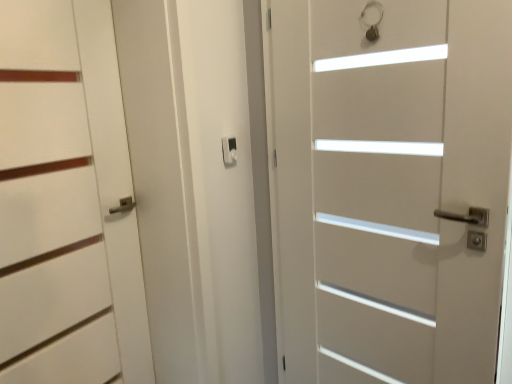
Locate an element on the screen. This screenshot has height=384, width=512. white matte door at center, which is counted as the 2th door, starting from the left is located at coordinates (388, 186).

At what (x,y) coordinates should I click in order to perform the action: click on white matte door at left, which ranks as the 1th door in left-to-right order. Please return your answer as a coordinate pair (x, y). The height and width of the screenshot is (384, 512). Looking at the image, I should click on (66, 202).

How different are the orientations of white matte door at left, positioned as the second door in right-to-left order, and white matte door at center, the first door in the right-to-left sequence, in degrees?

The angle between the facing direction of white matte door at left, positioned as the second door in right-to-left order, and the facing direction of white matte door at center, the first door in the right-to-left sequence, is 113 degrees.

Is white matte door at left, positioned as the second door in right-to-left order, not close to white matte door at center, the first door in the right-to-left sequence?

They are positioned close to each other.

The width and height of the screenshot is (512, 384). Find the location of `door in front of the white matte door at left, which ranks as the 1th door in left-to-right order`. door in front of the white matte door at left, which ranks as the 1th door in left-to-right order is located at coordinates (388, 186).

Considering the positions of objects white matte door at left, which ranks as the 1th door in left-to-right order, and white matte door at center, the first door in the right-to-left sequence, in the image provided, who is behind, white matte door at left, which ranks as the 1th door in left-to-right order, or white matte door at center, the first door in the right-to-left sequence,?

A: Positioned behind is white matte door at left, which ranks as the 1th door in left-to-right order.

Is white matte door at left, positioned as the second door in right-to-left order, next to matte black latch at center?

No, white matte door at left, positioned as the second door in right-to-left order, is not beside matte black latch at center.

From the image's perspective, is white matte door at left, positioned as the second door in right-to-left order, below matte black latch at center?

Correct, white matte door at left, positioned as the second door in right-to-left order, appears lower than matte black latch at center in the image.

Considering the relative positions of white matte door at left, which ranks as the 1th door in left-to-right order, and matte black latch at center in the image provided, is white matte door at left, which ranks as the 1th door in left-to-right order, to the left of matte black latch at center from the viewer's perspective?

Correct, you'll find white matte door at left, which ranks as the 1th door in left-to-right order, to the left of matte black latch at center.

Is white matte door at left, positioned as the second door in right-to-left order, oriented away from matte black latch at center?

No, matte black latch at center is not at the back of white matte door at left, positioned as the second door in right-to-left order.

Which of these two, white matte door at center, the first door in the right-to-left sequence, or matte black latch at center, is smaller?

Smaller between the two is matte black latch at center.

Are white matte door at center, the first door in the right-to-left sequence, and matte black latch at center located far from each other?

No, there isn't a large distance between white matte door at center, the first door in the right-to-left sequence, and matte black latch at center.

Is matte black latch at center a part of white matte door at center, the first door in the right-to-left sequence?

No, matte black latch at center is not a part of white matte door at center, the first door in the right-to-left sequence.

Which object is closer to the camera taking this photo, white matte door at center, the first door in the right-to-left sequence, or matte black latch at center?

white matte door at center, the first door in the right-to-left sequence, is in front.

Is white matte door at center, the first door in the right-to-left sequence, closer to the viewer compared to white matte door at left, positioned as the second door in right-to-left order?

Yes, white matte door at center, the first door in the right-to-left sequence, is closer to the camera.

Considering the points (298, 369) and (20, 344), which point is in front, point (298, 369) or point (20, 344)?

Point (20, 344)

Is white matte door at center, the first door in the right-to-left sequence, thinner than white matte door at left, positioned as the second door in right-to-left order?

No, white matte door at center, the first door in the right-to-left sequence, is not thinner than white matte door at left, positioned as the second door in right-to-left order.

Is white matte door at center, the first door in the right-to-left sequence, looking in the opposite direction of white matte door at left, positioned as the second door in right-to-left order?

That's not correct — white matte door at center, the first door in the right-to-left sequence, is not looking away from white matte door at left, positioned as the second door in right-to-left order.

Measure the distance between matte black latch at center and white matte door at left, positioned as the second door in right-to-left order.

The distance of matte black latch at center from white matte door at left, positioned as the second door in right-to-left order, is 25.45 inches.

From the image's perspective, count 1st doors downward from the matte black latch at center and point to it. Please provide its 2D coordinates.

[(66, 202)]

Does point (224, 140) come farther from viewer compared to point (34, 5)?

That is True.

Based on their sizes in the image, would you say matte black latch at center is bigger or smaller than white matte door at left, which ranks as the 1th door in left-to-right order?

Clearly, matte black latch at center is smaller in size than white matte door at left, which ranks as the 1th door in left-to-right order.

Does matte black latch at center have a greater width compared to white matte door at center, the first door in the right-to-left sequence?

No, matte black latch at center is not wider than white matte door at center, the first door in the right-to-left sequence.

Can you tell me how much matte black latch at center and white matte door at center, which is counted as the 2th door, starting from the left, differ in facing direction?

113 degrees.

Can you confirm if matte black latch at center is positioned to the right of white matte door at center, which is counted as the 2th door, starting from the left?

In fact, matte black latch at center is to the left of white matte door at center, which is counted as the 2th door, starting from the left.

Who is smaller, matte black latch at center or white matte door at center, the first door in the right-to-left sequence?

Smaller between the two is matte black latch at center.

I want to click on door above the white matte door at center, the first door in the right-to-left sequence (from the image's perspective), so click(66, 202).

Which door is the 1st one when counting from the front of the matte black latch at center? Please provide its 2D coordinates.

[(66, 202)]

When comparing their distances from matte black latch at center, does white matte door at left, which ranks as the 1th door in left-to-right order, or white matte door at center, the first door in the right-to-left sequence, seem closer?

white matte door at left, which ranks as the 1th door in left-to-right order.

From the image, which object appears to be farther from white matte door at center, which is counted as the 2th door, starting from the left, matte black latch at center or white matte door at left, which ranks as the 1th door in left-to-right order?

white matte door at left, which ranks as the 1th door in left-to-right order, lies further to white matte door at center, which is counted as the 2th door, starting from the left, than the other object.

Considering their positions, is white matte door at left, which ranks as the 1th door in left-to-right order, positioned further to white matte door at center, the first door in the right-to-left sequence, than matte black latch at center?

Among the two, white matte door at left, which ranks as the 1th door in left-to-right order, is located further to white matte door at center, the first door in the right-to-left sequence.

Based on their spatial positions, is white matte door at center, the first door in the right-to-left sequence, or white matte door at left, positioned as the second door in right-to-left order, further from matte black latch at center?

Based on the image, white matte door at center, the first door in the right-to-left sequence, appears to be further to matte black latch at center.

Estimate the real-world distances between objects in this image. Which object is further from white matte door at left, positioned as the second door in right-to-left order, matte black latch at center or white matte door at center, the first door in the right-to-left sequence?

Based on the image, white matte door at center, the first door in the right-to-left sequence, appears to be further to white matte door at left, positioned as the second door in right-to-left order.

Based on their spatial positions, is white matte door at center, the first door in the right-to-left sequence, or matte black latch at center further from white matte door at left, which ranks as the 1th door in left-to-right order?

The object further to white matte door at left, which ranks as the 1th door in left-to-right order, is white matte door at center, the first door in the right-to-left sequence.

The height and width of the screenshot is (384, 512). I want to click on latch situated between white matte door at left, which ranks as the 1th door in left-to-right order, and white matte door at center, which is counted as the 2th door, starting from the left, from left to right, so [229, 150].